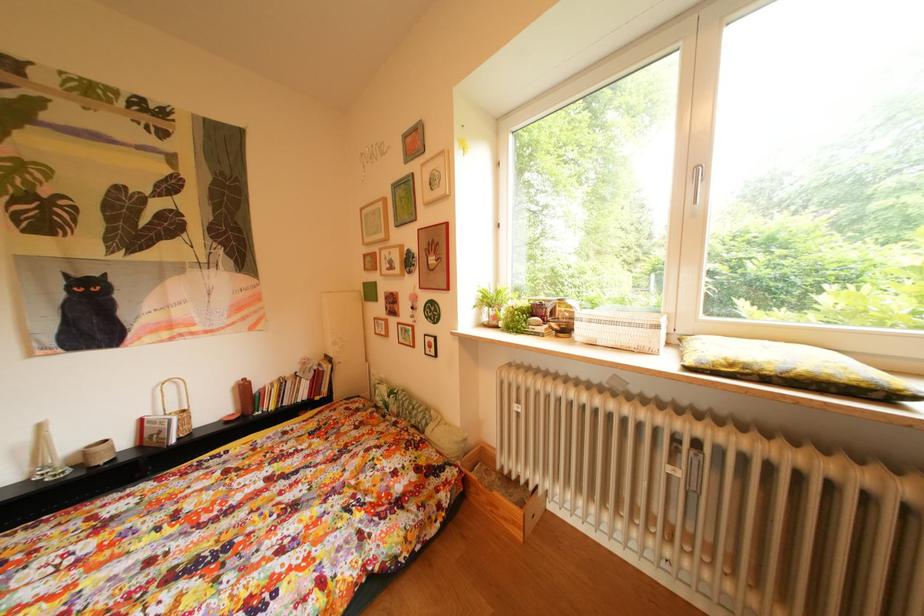
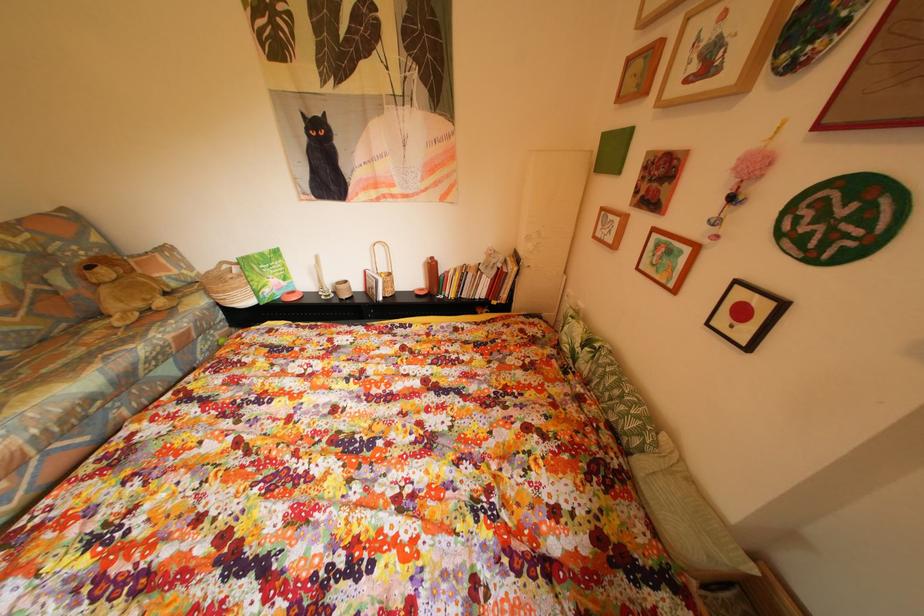
How did the camera likely rotate?

The camera rotated toward left-down.